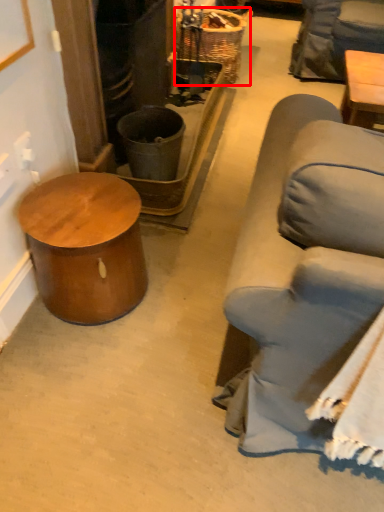
Question: From the image's perspective, where is basket (annotated by the red box) located relative to table?

Choices:
 (A) above
 (B) below

Answer: (A)